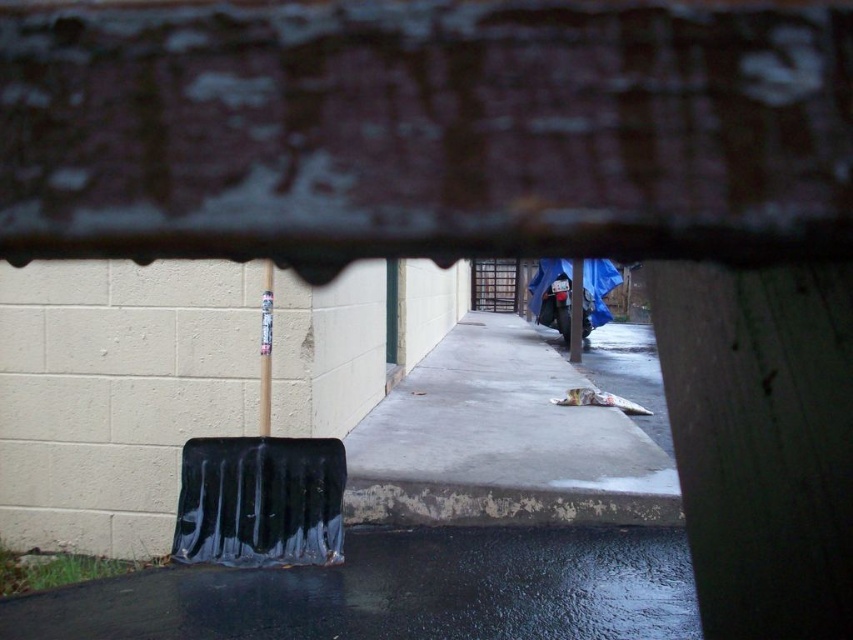
You are standing at the center of the image and want to locate the smooth white pole at center. According to the coordinates provided, in which direction should you look to find it?

The smooth white pole at center is located at coordinates point (265, 349), so you should look slightly to the right and upward from the center to find it.

You are standing at the point closer to the camera between the two points, point (547, 406) and point (267, 285). Which point are you standing at?

You are standing at point (547, 406) because it is further to the camera than point (267, 285).